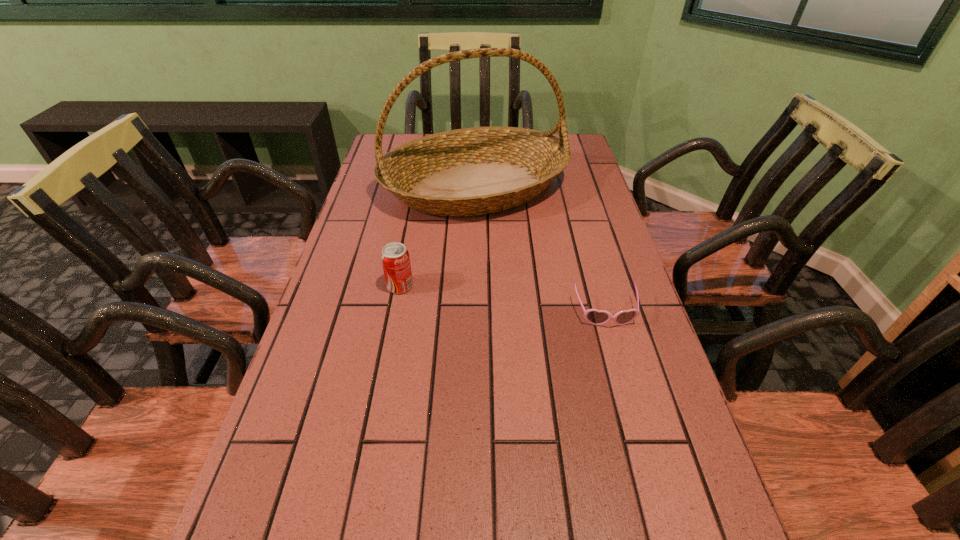
In order to click on vacant space that is in between the shortest object and the second nearest object in this screenshot , I will do `click(503, 299)`.

The height and width of the screenshot is (540, 960). I want to click on unoccupied area between the soda can and the nearest object, so click(503, 299).

Where is `blank region between the second farthest object and the tallest object`? The height and width of the screenshot is (540, 960). blank region between the second farthest object and the tallest object is located at coordinates (438, 237).

Where is `free area in between the basket and the second nearest object`? This screenshot has height=540, width=960. free area in between the basket and the second nearest object is located at coordinates point(438,237).

What are the coordinates of `vacant point located between the farthest object and the soda can` in the screenshot? It's located at (438, 237).

Image resolution: width=960 pixels, height=540 pixels. In order to click on the closest object to the second nearest object in this screenshot , I will do `click(474, 171)`.

Locate which object ranks second in proximity to the shortest object. Please provide its 2D coordinates. Your answer should be formatted as a tuple, i.e. [(x, y)], where the tuple contains the x and y coordinates of a point satisfying the conditions above.

[(395, 258)]